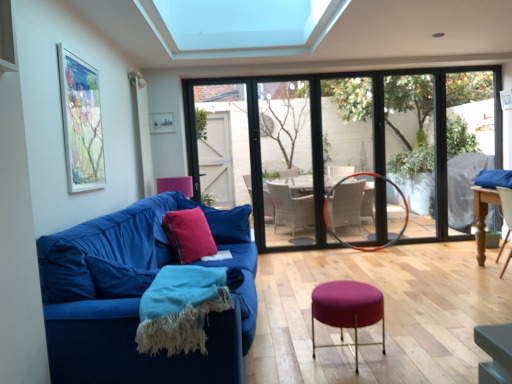
This screenshot has height=384, width=512. I want to click on free space above purple fabric stool at center (from a real-world perspective), so click(x=337, y=288).